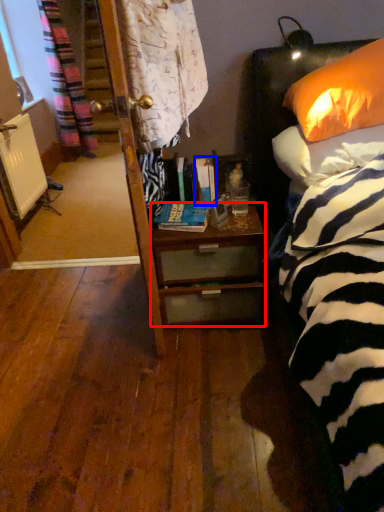
Question: Which of the following is the farthest to the observer, desk (highlighted by a red box) or book (highlighted by a blue box)?

Choices:
 (A) desk
 (B) book

Answer: (B)